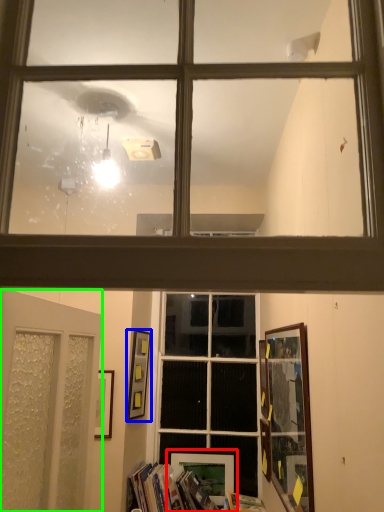
Question: Based on their relative distances, which object is nearer to picture frame (highlighted by a red box)? Choose from picture frame (highlighted by a blue box) and door (highlighted by a green box).

Choices:
 (A) picture frame
 (B) door

Answer: (A)